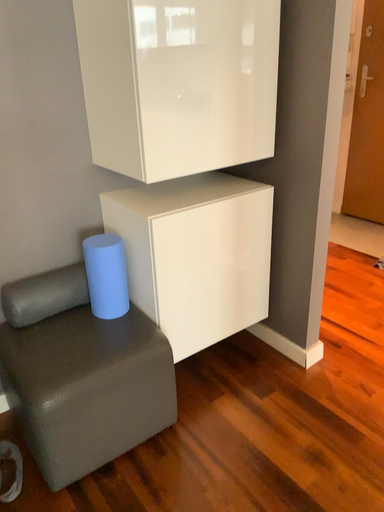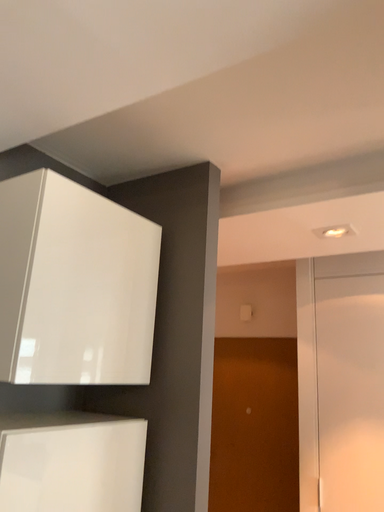
Question: How did the camera likely rotate when shooting the video?

Choices:
 (A) rotated upward
 (B) rotated downward

Answer: (A)